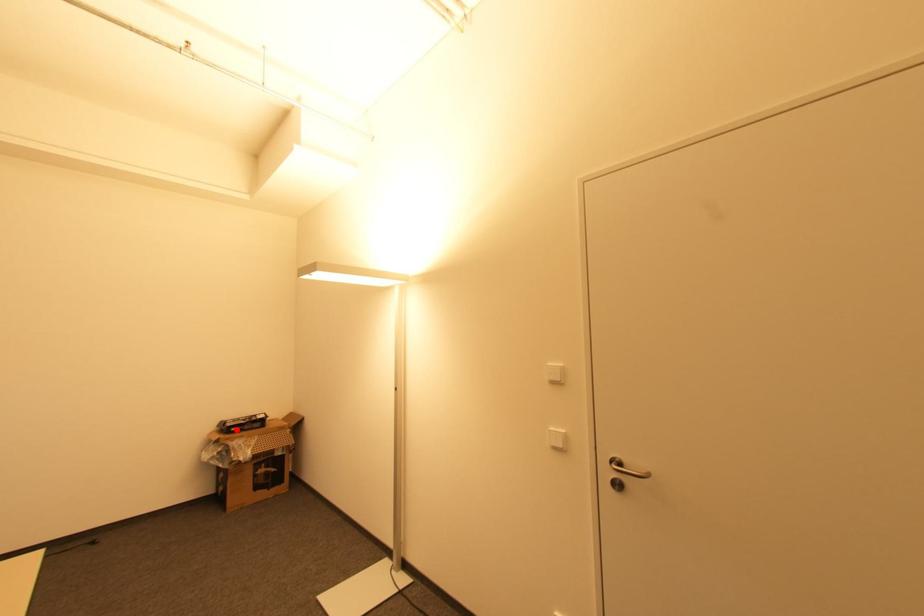
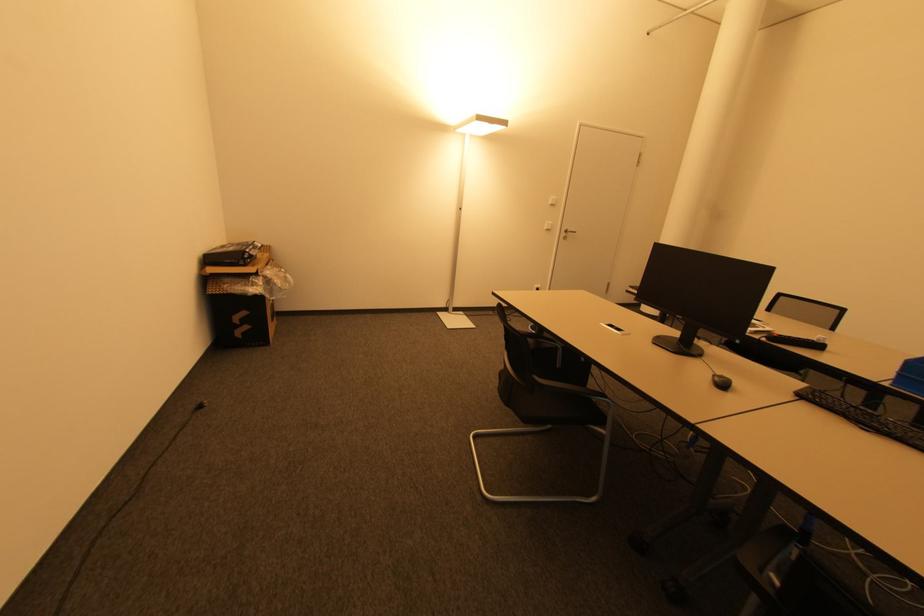
In the second image, find the point that corresponds to the highlighted location in the first image.

(250, 261)